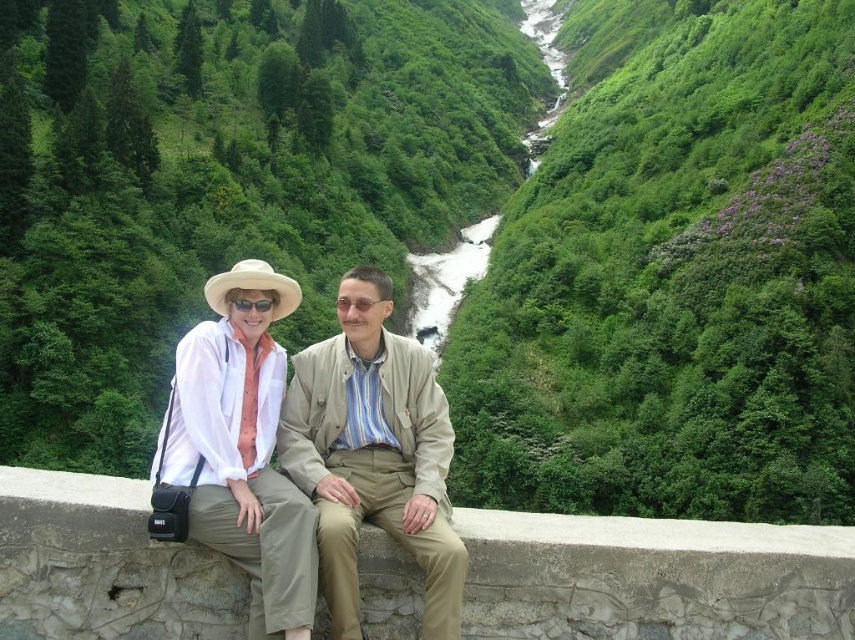
You are a photographer trying to capture a photo of both individuals in the scene. You notice two points marked in the image. The first point is at coordinates point (404, 458) and the second is at point (270, 401). Which point is closer to the camera and should be focused on to ensure both subjects are in sharp focus?

Point (404, 458) is closer to the camera than point (270, 401). To ensure both subjects are in sharp focus, focus on the closer point, which is point (404, 458).

You are a photographer trying to capture a candid shot of both the beige fabric jacket at center and the white matte hat at upper left. Since you can only focus on one subject at a time, which one should you aim for first to ensure the other is still in frame?

The beige fabric jacket at center is to the right of the white matte hat at upper left, so you should aim for the white matte hat at upper left first. This way, when you pan to the right to include the beige fabric jacket at center, the hat will remain in the frame.